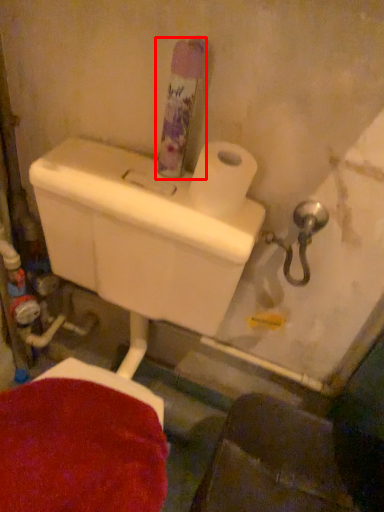
Question: Observing the image, what is the correct spatial positioning of toiletry (annotated by the red box) in reference to toilet paper?

Choices:
 (A) left
 (B) right

Answer: (A)